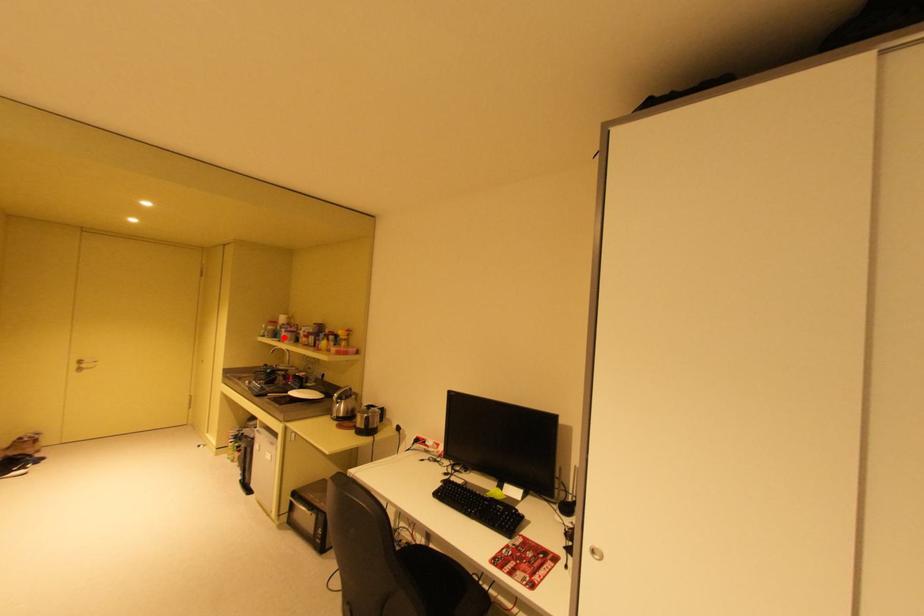
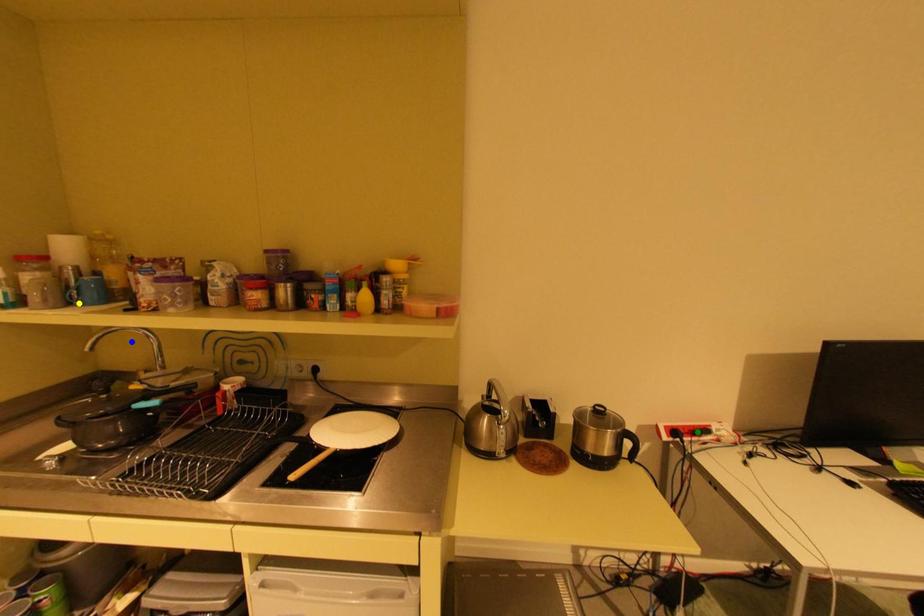
Question: I am providing you with two images of the same scene from different viewpoints. A red point is marked on the first image. You are given multiple points on the second image. Which mark in image 2 goes with the point in image 1?

Choices:
 (A) blue point
 (B) green point
 (C) yellow point

Answer: (C)